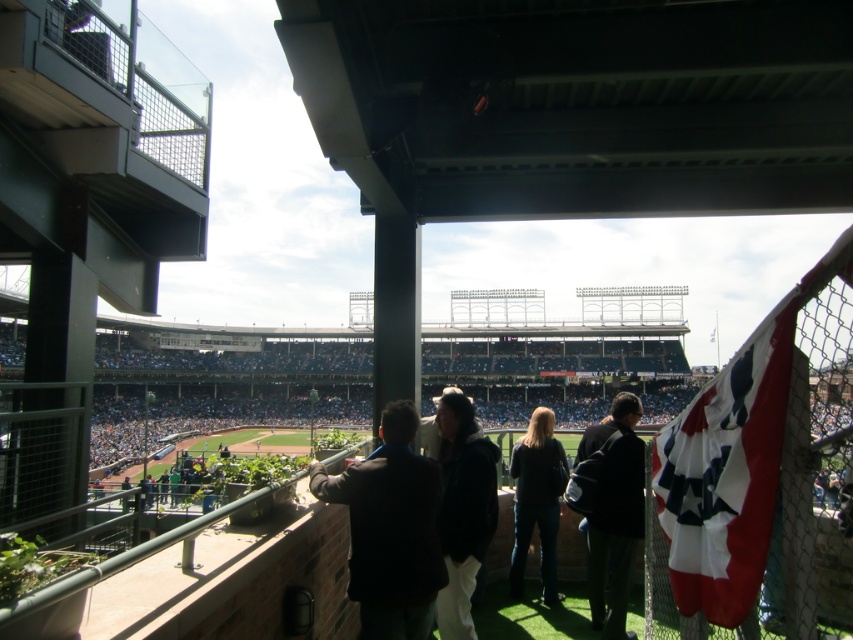
Is dark brown leather jacket at center wider than dark gray jacket at center?

Yes.

Is point (395, 544) positioned after point (450, 513)?

No.

Image resolution: width=853 pixels, height=640 pixels. What are the coordinates of `dark brown leather jacket at center` in the screenshot? It's located at (390, 529).

Can you confirm if red and white fabric flag at right is thinner than dark blue jacket at lower right?

No, red and white fabric flag at right is not thinner than dark blue jacket at lower right.

Can you confirm if red and white fabric flag at right is smaller than dark blue jacket at lower right?

No, red and white fabric flag at right is not smaller than dark blue jacket at lower right.

Which is behind, point (729, 404) or point (610, 560)?

The point (610, 560) is more distant.

Find the location of a particular element. red and white fabric flag at right is located at coordinates (743, 468).

Does point (772, 358) come farther from viewer compared to point (492, 492)?

No.

Which of these two, red and white fabric flag at right or dark gray jacket at center, stands shorter?

Standing shorter between the two is dark gray jacket at center.

Locate an element on the screen. The width and height of the screenshot is (853, 640). red and white fabric flag at right is located at coordinates (743, 468).

In order to click on red and white fabric flag at right in this screenshot , I will do `click(743, 468)`.